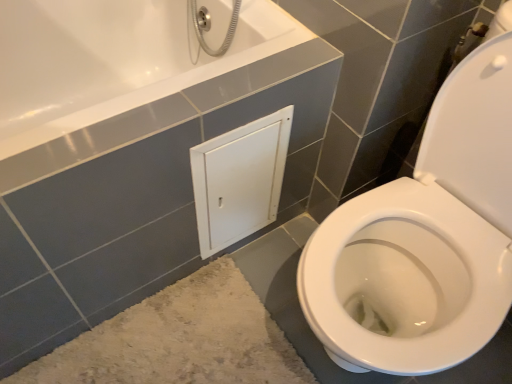
Locate an element on the screen. Image resolution: width=512 pixels, height=384 pixels. vacant space situated above beige shaggy bath mat at lower left (from a real-world perspective) is located at coordinates (176, 345).